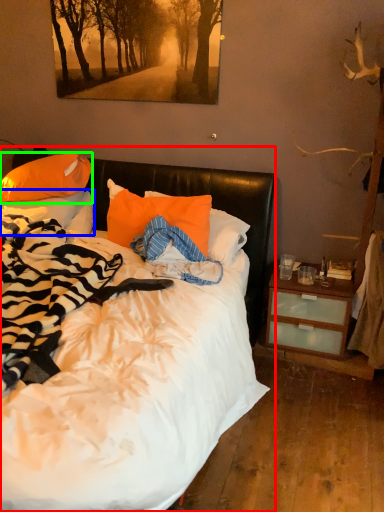
Question: Estimate the real-world distances between objects in this image. Which object is farther from bed (highlighted by a red box), pillow (highlighted by a blue box) or pillow (highlighted by a green box)?

Choices:
 (A) pillow
 (B) pillow

Answer: (B)